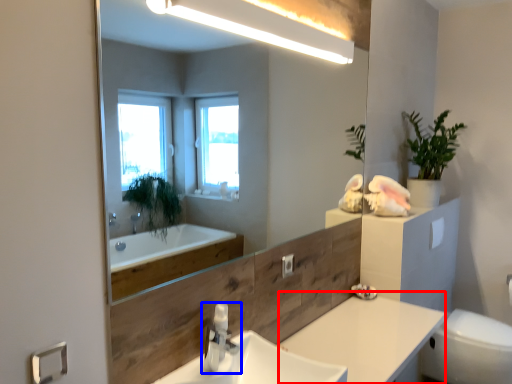
Question: Which object appears farthest to the camera in this image, counter top (highlighted by a red box) or tap (highlighted by a blue box)?

Choices:
 (A) counter top
 (B) tap

Answer: (A)